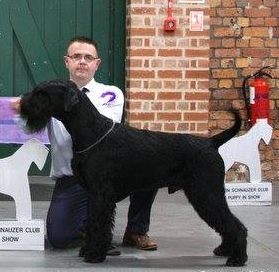
At what (x,y) coordinates should I click in order to perform the action: click on alarm button. Please return your answer as a coordinate pair (x, y). Image resolution: width=279 pixels, height=272 pixels. Looking at the image, I should click on (172, 26).